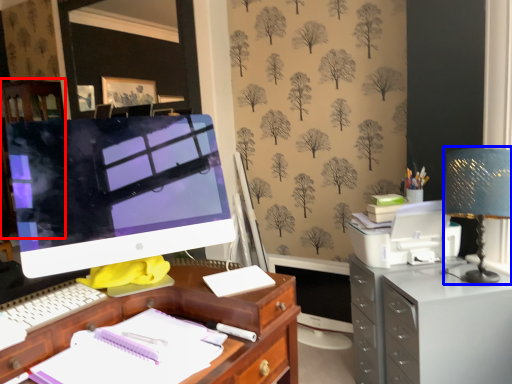
Question: Which object appears farthest to the camera in this image, dresser (highlighted by a red box) or table lamp (highlighted by a blue box)?

Choices:
 (A) dresser
 (B) table lamp

Answer: (A)